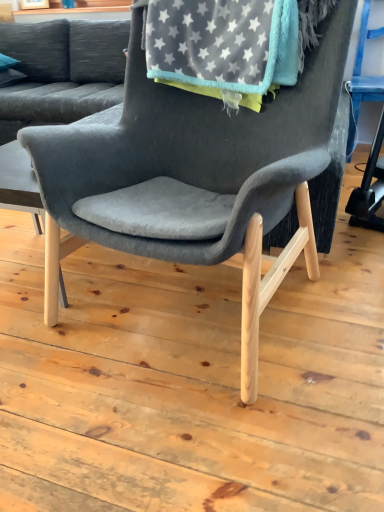
Question: Would you say light wood table at center is to the left or to the right of velvet gray chair at center in the picture?

Choices:
 (A) right
 (B) left

Answer: (B)

Question: Do you think light wood table at center is within velvet gray chair at center, or outside of it?

Choices:
 (A) inside
 (B) outside

Answer: (B)

Question: Which object is positioned farthest from the velvet gray chair at center?

Choices:
 (A) velvet gray couch at upper left
 (B) light wood table at center
 (C) gray fleece blanket at upper center

Answer: (A)

Question: Considering the real-world distances, which object is farthest from the gray fleece blanket at upper center?

Choices:
 (A) velvet gray couch at upper left
 (B) light wood table at center
 (C) velvet gray chair at center

Answer: (A)